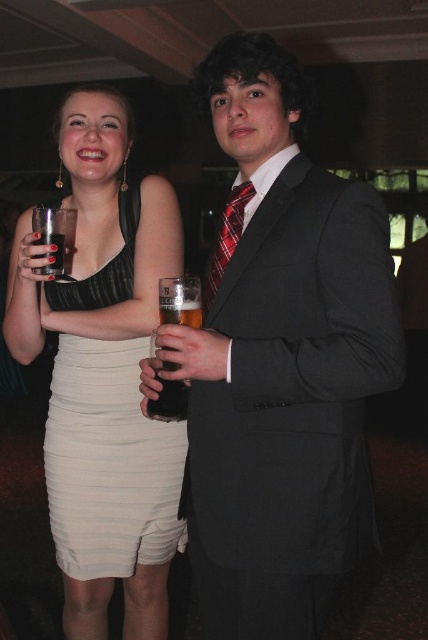
Is point (317, 250) in front of point (56, 250)?

Yes, it is.

From the picture: Is matte black suit at center taller than clear glass at upper left?

Indeed, matte black suit at center has a greater height compared to clear glass at upper left.

Who is more forward, (178, 358) or (53, 257)?

Positioned in front is point (178, 358).

The width and height of the screenshot is (428, 640). Find the location of `matte black suit at center`. matte black suit at center is located at coordinates (281, 365).

Measure the distance between point (157, 516) and camera.

The distance of point (157, 516) from camera is 4.95 feet.

Does point (53, 410) lie behind point (39, 268)?

Yes.

Where is `white satin dress at center`? The height and width of the screenshot is (640, 428). white satin dress at center is located at coordinates (109, 461).

What are the coordinates of `red plaid tie at center` in the screenshot? It's located at (225, 240).

Is red plaid tie at center taller than clear glass at upper left?

Yes.

What are the coordinates of `red plaid tie at center` in the screenshot? It's located at (225, 240).

Find the location of a particular element. red plaid tie at center is located at coordinates (225, 240).